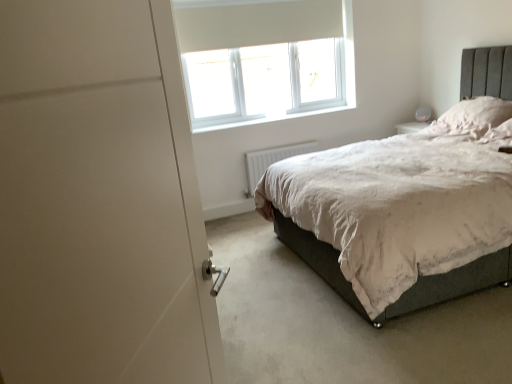
Question: Considering the positions of point (245, 97) and point (505, 104), is point (245, 97) closer or farther from the camera than point (505, 104)?

Choices:
 (A) farther
 (B) closer

Answer: (A)

Question: In terms of width, does white plastic window at upper center look wider or thinner when compared to white fluffy pillow at upper right?

Choices:
 (A) wide
 (B) thin

Answer: (B)

Question: Estimate the real-world distances between objects in this image. Which object is closer to the white fluffy pillow at upper right?

Choices:
 (A) white plastic radiator at lower center
 (B) white matte door at left
 (C) white plastic window at upper center

Answer: (A)

Question: Which of these objects is positioned farthest from the white plastic radiator at lower center?

Choices:
 (A) white plastic window at upper center
 (B) white matte door at left
 (C) white fluffy pillow at upper right

Answer: (B)